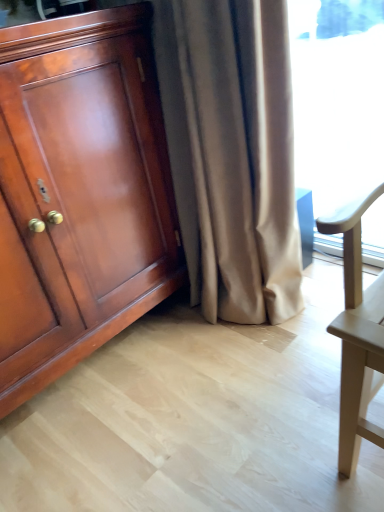
Where is `shiny wood cabinet at left`? This screenshot has width=384, height=512. shiny wood cabinet at left is located at coordinates (79, 192).

Describe the element at coordinates (79, 192) in the screenshot. Image resolution: width=384 pixels, height=512 pixels. I see `shiny wood cabinet at left` at that location.

Locate an element on the screen. The height and width of the screenshot is (512, 384). satin beige curtain at center is located at coordinates (232, 153).

What do you see at coordinates (232, 153) in the screenshot? I see `satin beige curtain at center` at bounding box center [232, 153].

Locate an element on the screen. The height and width of the screenshot is (512, 384). shiny wood cabinet at left is located at coordinates (79, 192).

In the image, is shiny wood cabinet at left on the left side or the right side of satin beige curtain at center?

From the image, it's evident that shiny wood cabinet at left is to the left of satin beige curtain at center.

In the image, is shiny wood cabinet at left positioned in front of or behind satin beige curtain at center?

In the image, shiny wood cabinet at left appears in front of satin beige curtain at center.

Does point (58, 234) come farther from viewer compared to point (211, 32)?

Yes, it is behind point (211, 32).

From the image's perspective, is shiny wood cabinet at left located above or below satin beige curtain at center?

Clearly, from the image's perspective, shiny wood cabinet at left is below satin beige curtain at center.

Consider the image. From a real-world perspective, is shiny wood cabinet at left positioned over satin beige curtain at center based on gravity?

Indeed, from a real-world perspective, shiny wood cabinet at left stands above satin beige curtain at center.

Which object is thinner, shiny wood cabinet at left or satin beige curtain at center?

satin beige curtain at center is thinner.

Between shiny wood cabinet at left and satin beige curtain at center, which one has more height?

Standing taller between the two is satin beige curtain at center.

Considering the relative sizes of shiny wood cabinet at left and satin beige curtain at center in the image provided, is shiny wood cabinet at left bigger than satin beige curtain at center?

Yes.

Is shiny wood cabinet at left situated inside satin beige curtain at center or outside?

shiny wood cabinet at left exists outside the volume of satin beige curtain at center.

Is shiny wood cabinet at left next to satin beige curtain at center?

No, shiny wood cabinet at left is not next to satin beige curtain at center.

Is shiny wood cabinet at left aimed at satin beige curtain at center?

No, shiny wood cabinet at left is not facing towards satin beige curtain at center.

This screenshot has height=512, width=384. I want to click on cabinetry on the left of satin beige curtain at center, so (x=79, y=192).

Considering the positions of objects satin beige curtain at center and shiny wood cabinet at left in the image provided, who is more to the left, satin beige curtain at center or shiny wood cabinet at left?

Positioned to the left is shiny wood cabinet at left.

Does satin beige curtain at center lie in front of shiny wood cabinet at left?

No, satin beige curtain at center is further to the viewer.

Considering the positions of point (279, 298) and point (32, 237), is point (279, 298) closer or farther from the camera than point (32, 237)?

Point (279, 298) appears to be farther away from the viewer than point (32, 237).

From the image's perspective, which object appears higher, satin beige curtain at center or shiny wood cabinet at left?

satin beige curtain at center appears higher in the image.

From a real-world perspective, is satin beige curtain at center above or below shiny wood cabinet at left?

In terms of real-world spatial position, satin beige curtain at center is below shiny wood cabinet at left.

Which of these two, satin beige curtain at center or shiny wood cabinet at left, is wider?

Wider between the two is shiny wood cabinet at left.

Is satin beige curtain at center taller than shiny wood cabinet at left?

Yes.

Which of these two, satin beige curtain at center or shiny wood cabinet at left, is bigger?

shiny wood cabinet at left is bigger.

Is shiny wood cabinet at left completely or partially inside satin beige curtain at center?

No, shiny wood cabinet at left is located outside of satin beige curtain at center.

Are satin beige curtain at center and shiny wood cabinet at left far apart?

satin beige curtain at center is near shiny wood cabinet at left, not far away.

Does satin beige curtain at center turn towards shiny wood cabinet at left?

No, satin beige curtain at center does not turn towards shiny wood cabinet at left.

Identify the location of cabinetry below the satin beige curtain at center (from the image's perspective). (79, 192).

In order to click on curtain behind the shiny wood cabinet at left in this screenshot , I will do `click(232, 153)`.

Locate an element on the screen. This screenshot has width=384, height=512. cabinetry that appears above the satin beige curtain at center (from a real-world perspective) is located at coordinates (79, 192).